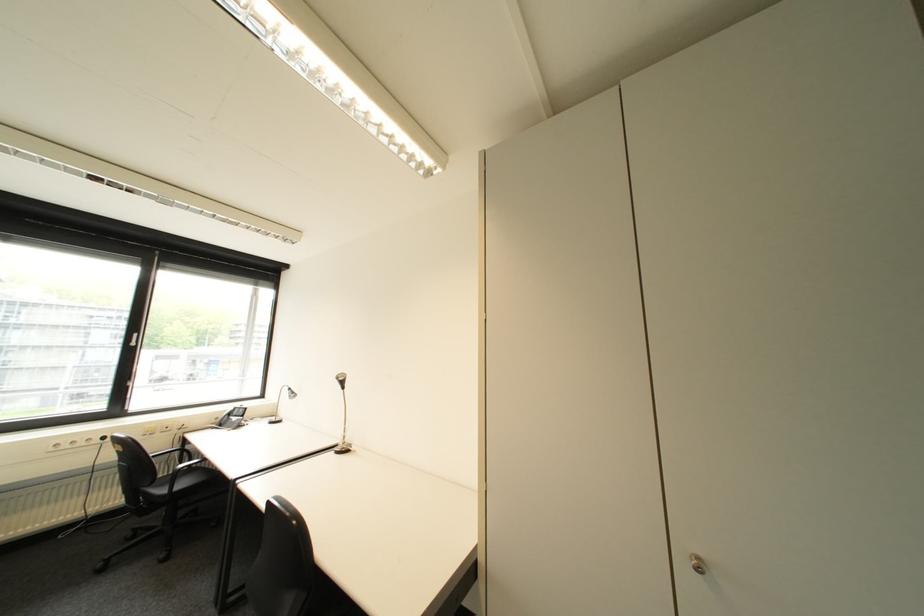
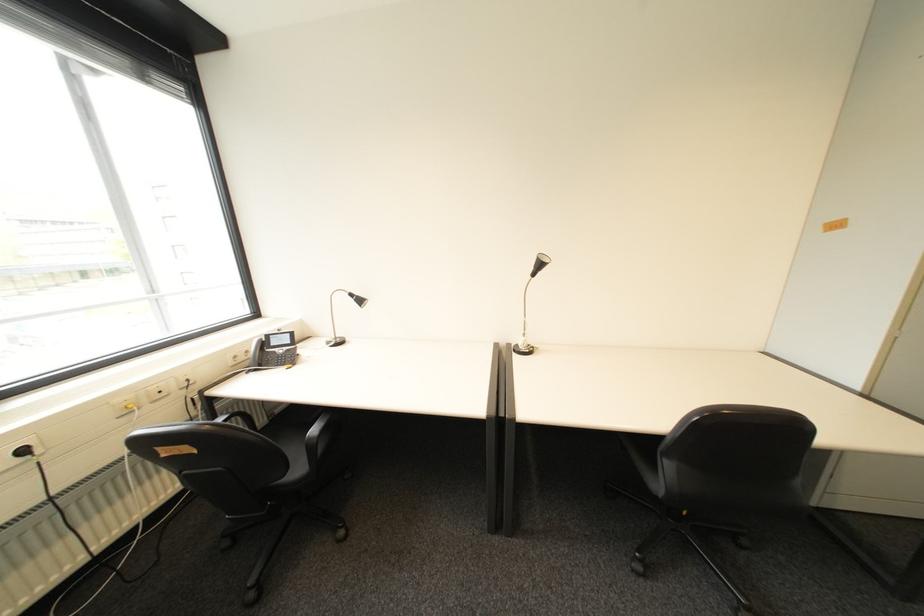
Where in the second image is the point corresponding to pixel 114 439 from the first image?

(34, 452)